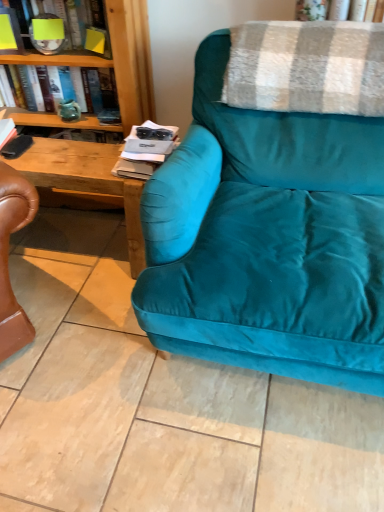
Identify the location of free spot to the left of teal velvet couch at center. Image resolution: width=384 pixels, height=512 pixels. (83, 342).